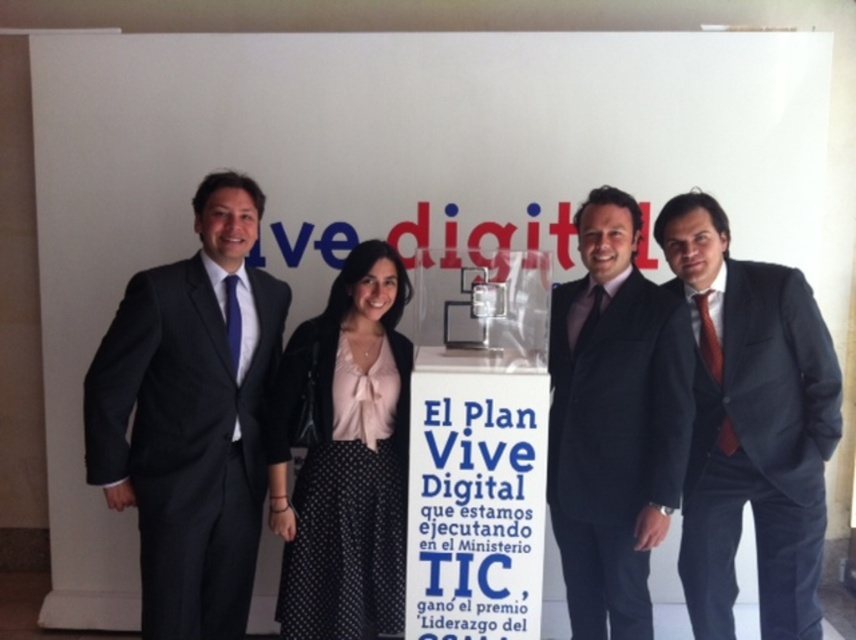
You are a photographer who needs to adjust the lighting to highlight the trophy. The trophy is in the center of the image. There is a point at coordinates point [752,426] that corresponds to the matte black suit at right. Where should you direct the light to avoid reflecting off the black suit?

The point [752,426] corresponds to the matte black suit at right. To avoid reflections, direct the light away from that area towards the trophy in the center.

You are an event organizer who needs to arrange seating for two guests wearing the dark gray suit at center and the black polka dot skirt at center. Given that the chairs are standard size, which guest might need a larger chair to accommodate their outfit?

The dark gray suit at center is bigger than the black polka dot skirt at center, so the guest wearing the dark gray suit at center would need a larger chair to accommodate their outfit.